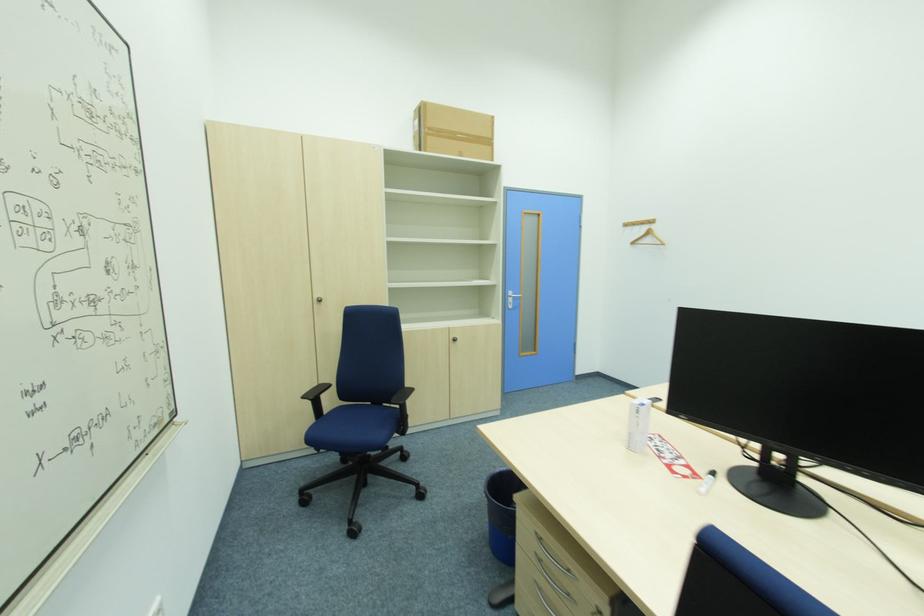
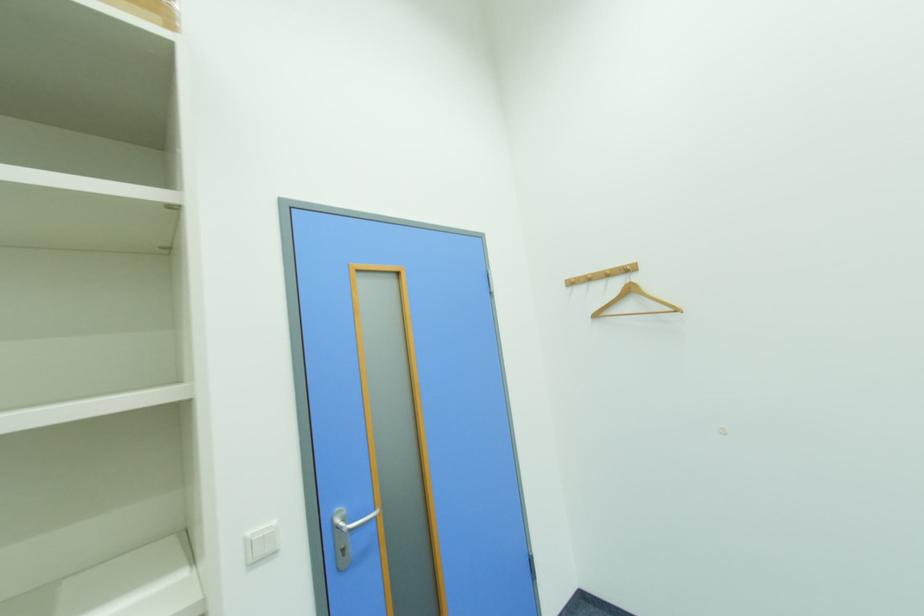
Find the pixel in the second image that matches pixel 658 221 in the first image.

(634, 267)